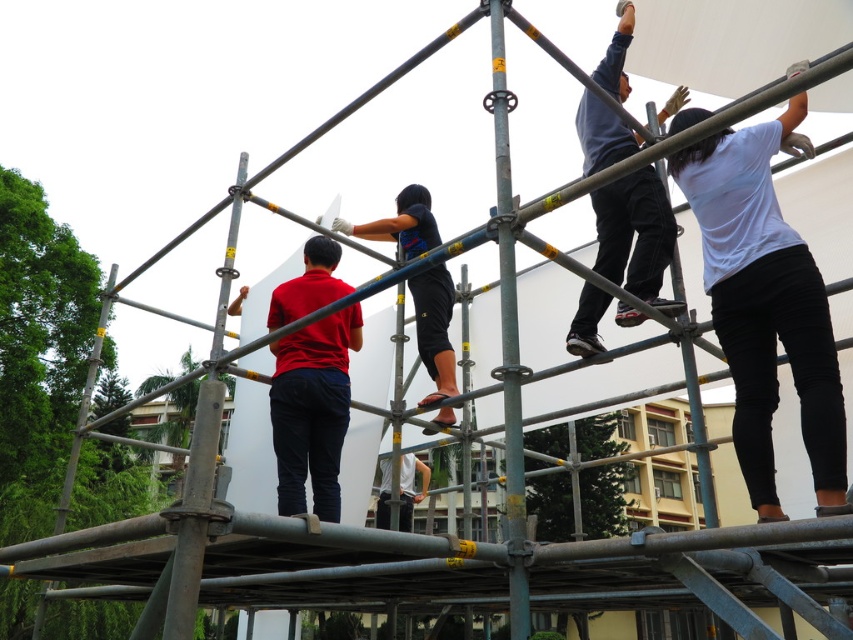
Question: Is white matte shirt at upper right further to the viewer compared to dark blue jeans at upper right?

Choices:
 (A) no
 (B) yes

Answer: (A)

Question: Which point is farther to the camera?

Choices:
 (A) dark blue jeans at upper right
 (B) dark blue fabric shirt at center
 (C) white matte shirt at upper right

Answer: (B)

Question: Is dark blue jeans at upper right above dark blue fabric shirt at center?

Choices:
 (A) no
 (B) yes

Answer: (B)

Question: Which of these objects is positioned closest to the dark blue fabric shirt at center?

Choices:
 (A) dark blue jeans at upper right
 (B) white matte shirt at upper right

Answer: (A)

Question: Is white matte shirt at upper right above dark blue fabric shirt at center?

Choices:
 (A) yes
 (B) no

Answer: (B)

Question: Which point is farther to the camera?

Choices:
 (A) white matte shirt at upper right
 (B) dark blue fabric shirt at center
 (C) dark blue jeans at upper right

Answer: (B)